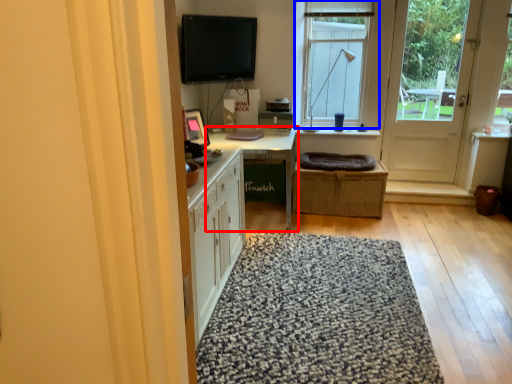
Question: Which object is closer to the camera taking this photo, table (highlighted by a red box) or window (highlighted by a blue box)?

Choices:
 (A) table
 (B) window

Answer: (A)